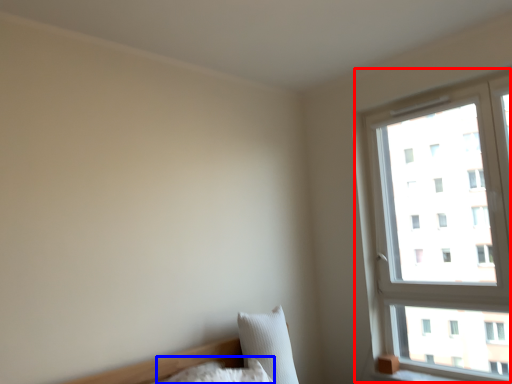
Question: Which object is further to the camera taking this photo, window (highlighted by a red box) or pillow (highlighted by a blue box)?

Choices:
 (A) window
 (B) pillow

Answer: (A)